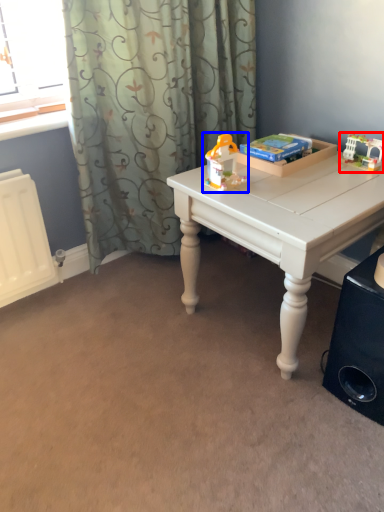
Question: Which of the following is the closest to the observer, toy (highlighted by a red box) or toy (highlighted by a blue box)?

Choices:
 (A) toy
 (B) toy

Answer: (B)